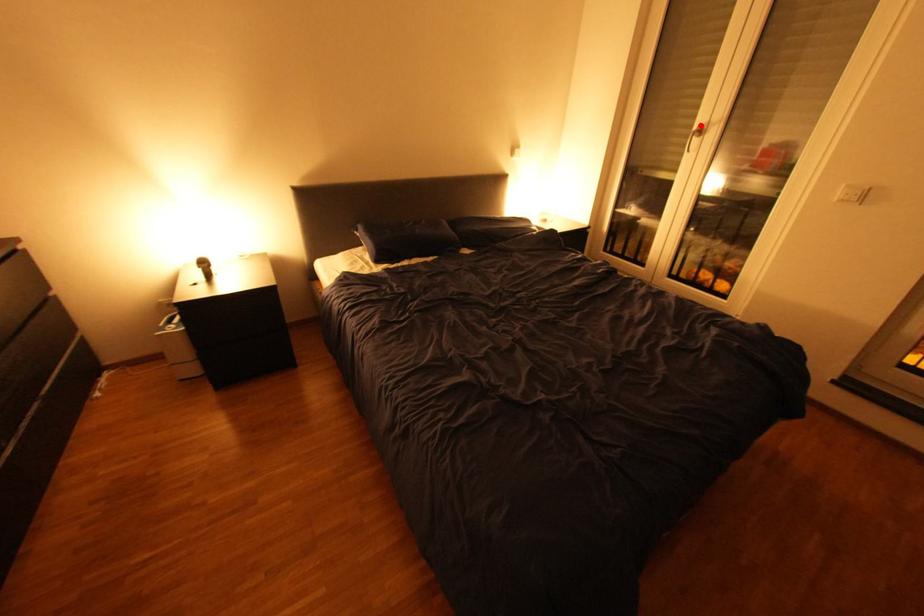
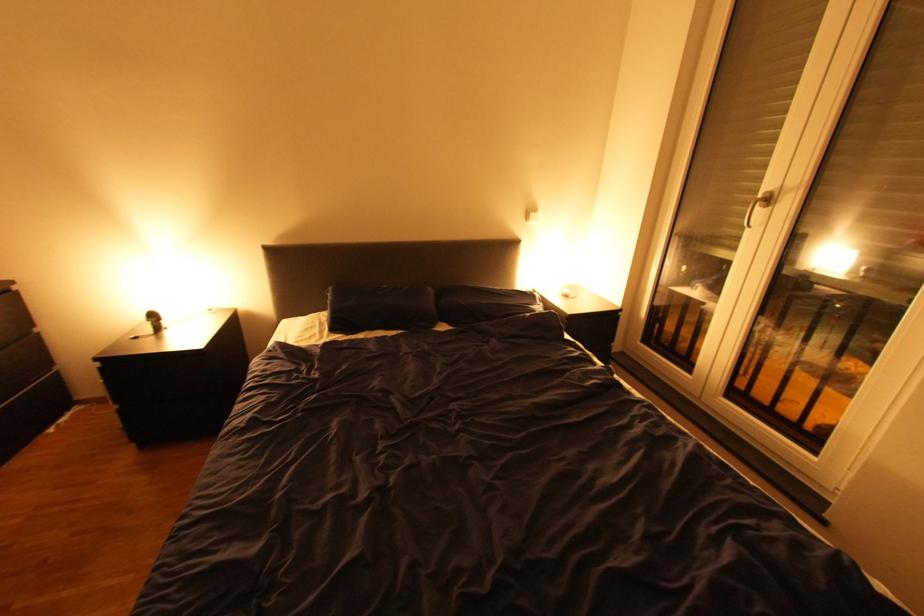
Locate, in the second image, the point that corresponds to the highlighted location in the first image.

(767, 192)